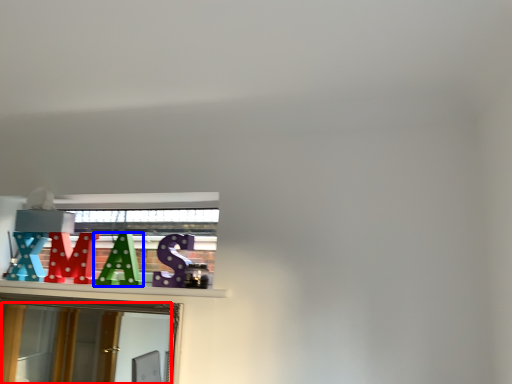
Question: Which of the following is the farthest to the observer, mirror (highlighted by a red box) or alphabet (highlighted by a blue box)?

Choices:
 (A) mirror
 (B) alphabet

Answer: (B)